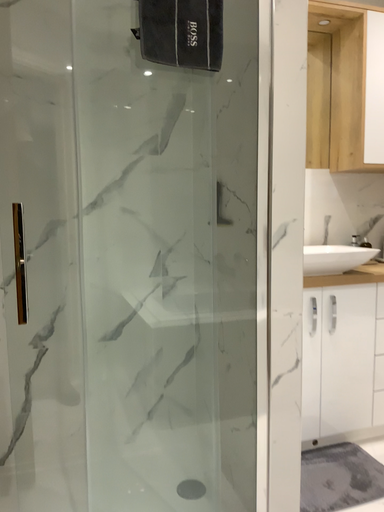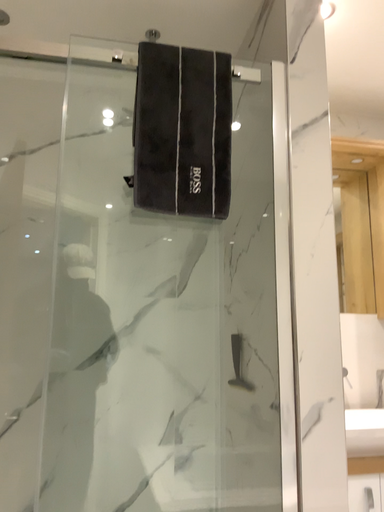
Question: How did the camera likely rotate when shooting the video?

Choices:
 (A) rotated upward
 (B) rotated downward

Answer: (A)